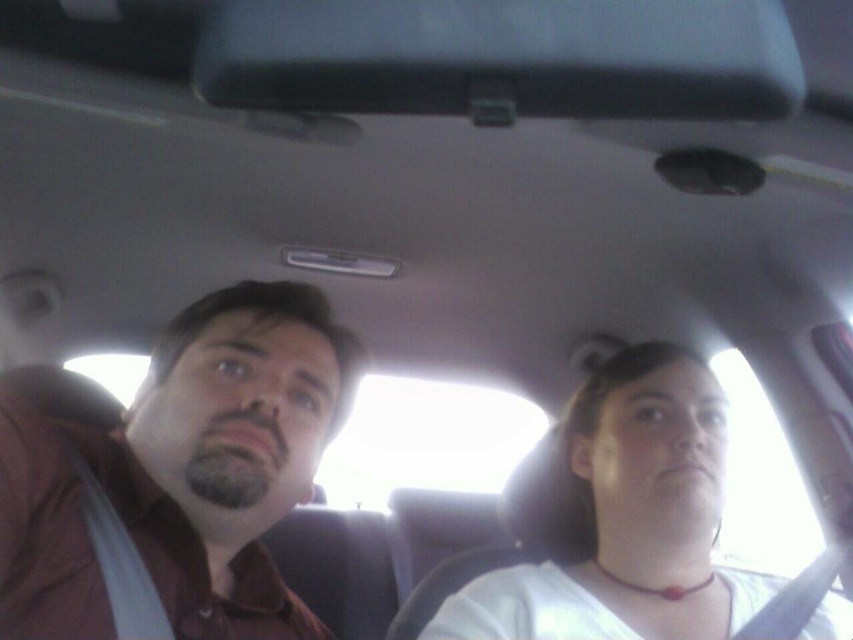
You are a passenger in the car and need to hand a document to the driver. The document is currently on the brown matte shirt at left. Which direction should you move the document to place it on the white matte shirt at center?

The brown matte shirt at left is positioned over the white matte shirt at center, so you should move the document downward to place it on the white matte shirt at center.

You are a tailor who needs to adjust the brown matte shirt at left and the white matte shirt at center. Which shirt requires more fabric to accommodate size differences?

The white matte shirt at center requires more fabric because it is larger than the brown matte shirt at left.

You are a passenger in the car and need to determine the seating arrangement based on the scene. Which person is sitting closer to the front of the car, the brown matte shirt at left or the white matte shirt at center?

The brown matte shirt at left is taller than the white matte shirt at center, so the brown matte shirt at left is sitting closer to the front of the car.